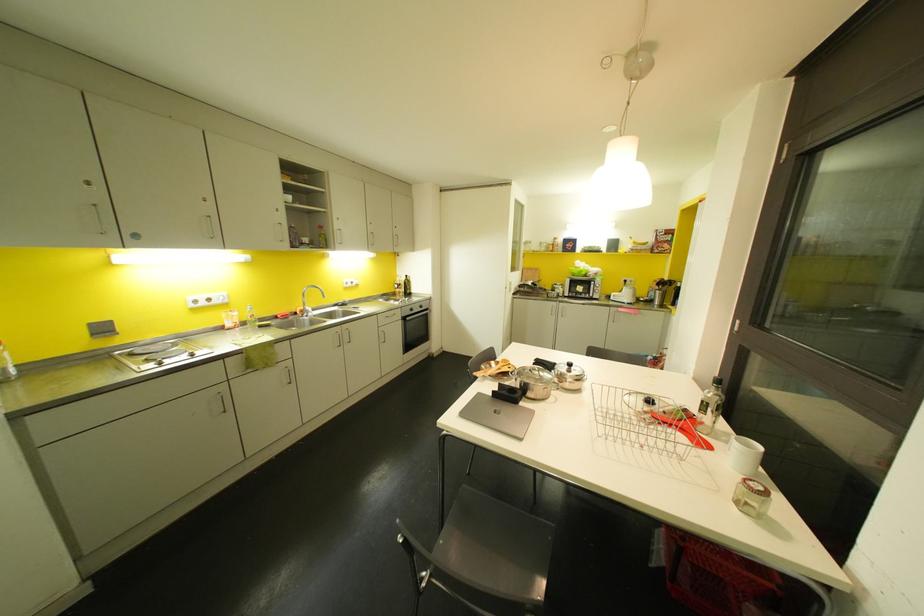
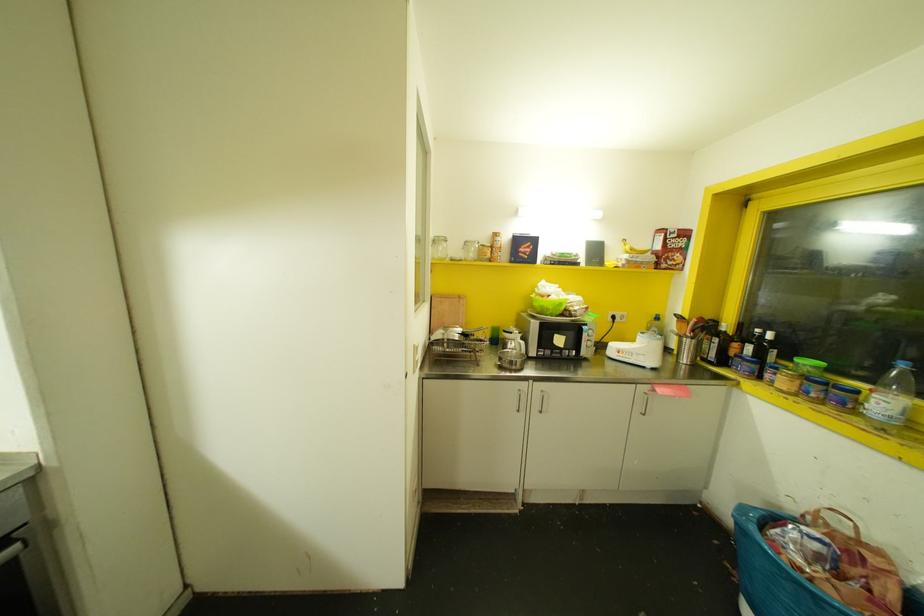
Question: The images are taken continuously from a first-person perspective. In which direction are you moving?

Choices:
 (A) Left
 (B) Right
 (C) Forward
 (D) Backward

Answer: (C)